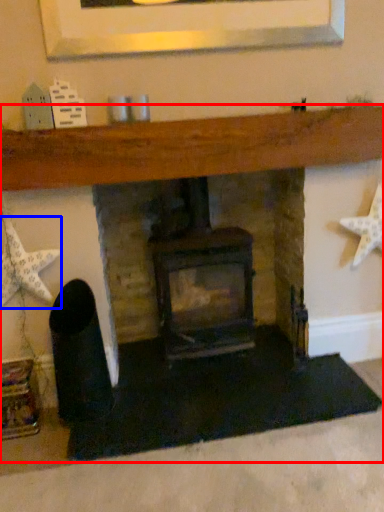
Question: Which object is closer to the camera taking this photo, fireplace (highlighted by a red box) or starfish (highlighted by a blue box)?

Choices:
 (A) fireplace
 (B) starfish

Answer: (A)